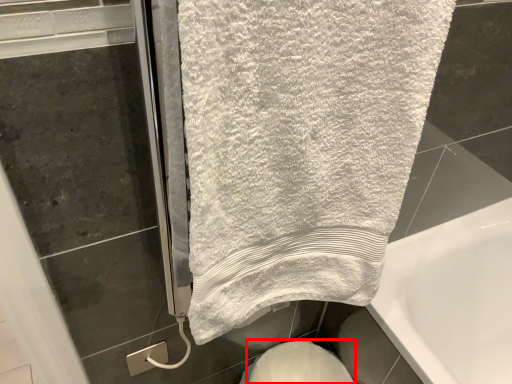
Question: From the image's perspective, where is bidet (annotated by the red box) located relative to towel?

Choices:
 (A) below
 (B) above

Answer: (A)